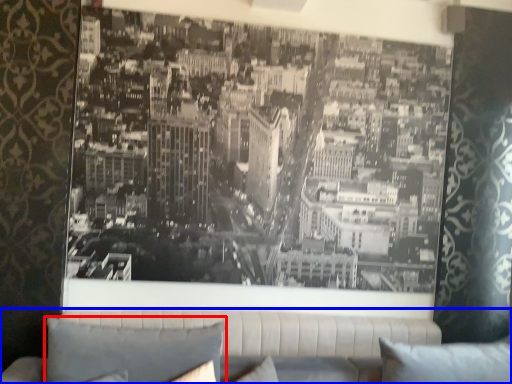
Question: Which point is further to the camera, pillow (highlighted by a red box) or studio couch (highlighted by a blue box)?

Choices:
 (A) pillow
 (B) studio couch

Answer: (B)